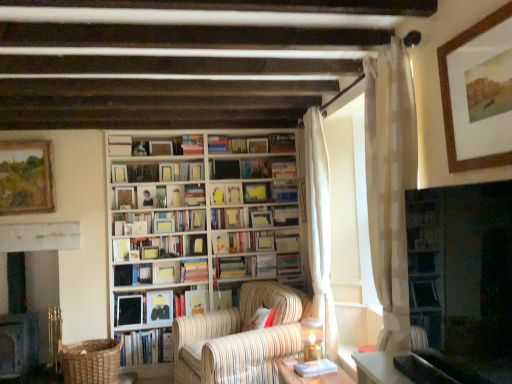
Question: Does point (129, 221) appear closer or farther from the camera than point (147, 321)?

Choices:
 (A) farther
 (B) closer

Answer: (A)

Question: In terms of height, does white paper book at center, which is the 10th book in bottom-to-top order, look taller or shorter compared to matte black book at center, placed as the 13th book when sorted from top to bottom?

Choices:
 (A) short
 (B) tall

Answer: (A)

Question: Which is nearer to the hardcover book at center, marked as the third book in a bottom-to-top arrangement?

Choices:
 (A) wooden table at lower center
 (B) hardcover book at lower left, which ranks as the 1th book in bottom-to-top order
 (C) black glossy tv at right
 (D) white sheer curtain at upper right, which is counted as the 2th curtain, starting from the back
 (E) hardcover book at center, the 16th book positioned from the bottom

Answer: (B)

Question: Considering the real-world distances, which object is closest to the hardcover books at center, marked as the 9th book in a top-to-bottom arrangement?

Choices:
 (A) white sheer curtain at right, the 1th curtain viewed from the back
 (B) wooden framed painting at upper right, the second picture frame positioned from the left
 (C) hardcover book at center, positioned as the fifth book in top-to-bottom order
 (D) hardcover book at lower center, arranged as the second book when ordered from the bottom
 (E) matte yellow book at center, the 10th book when ordered from top to bottom

Answer: (E)